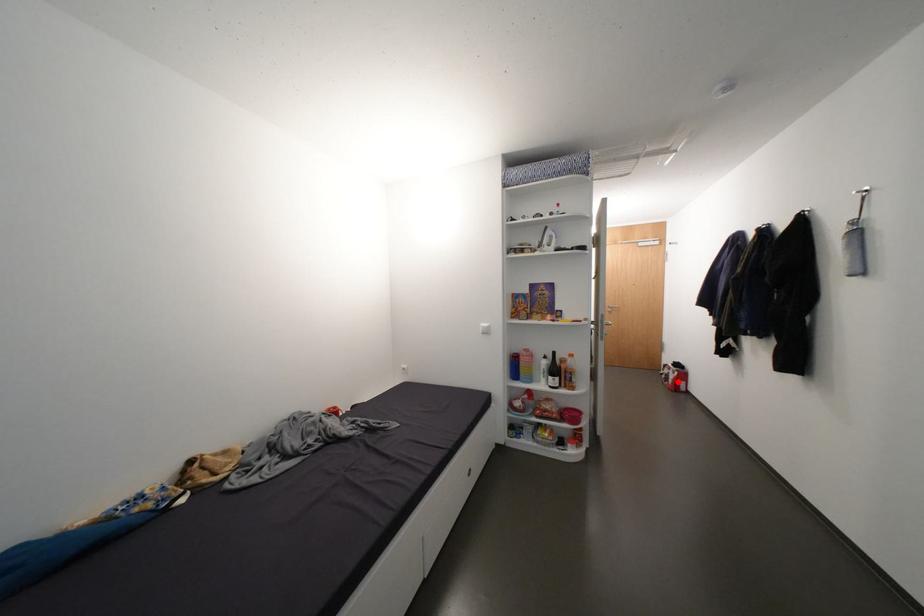
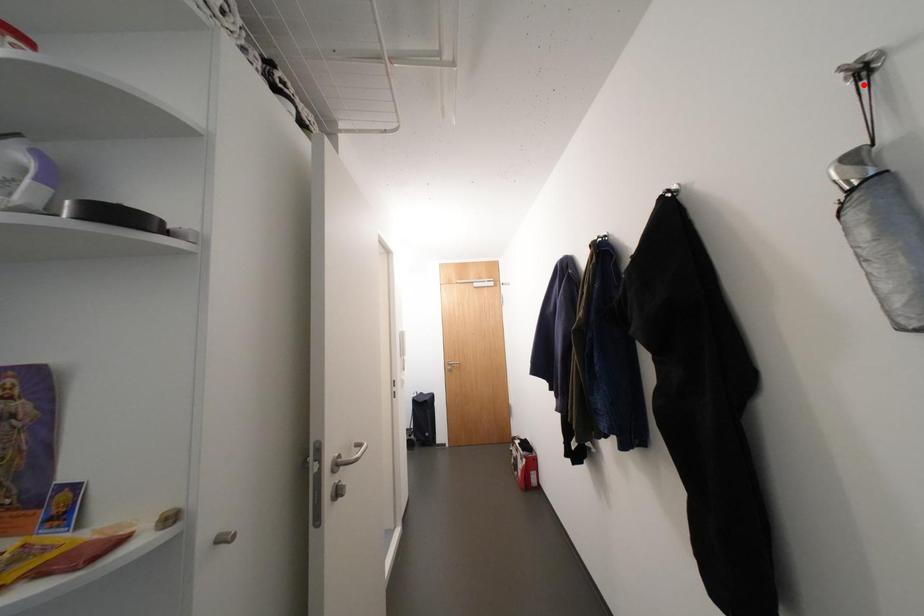
I am providing you with two images of the same scene from different viewpoints. A red point is marked on the first image and another point is marked on the second image. Are the points marked in image1 and image2 representing the same 3D position?

No